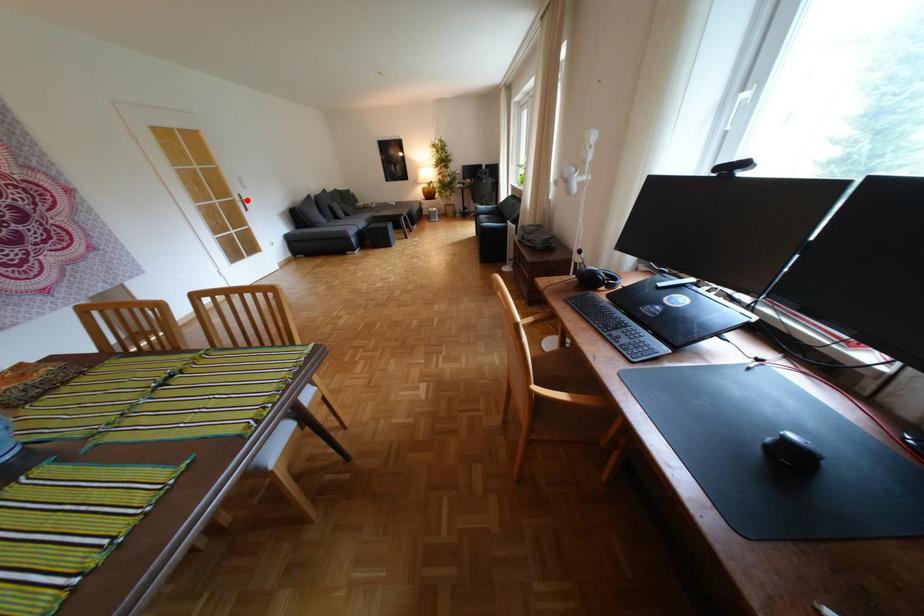
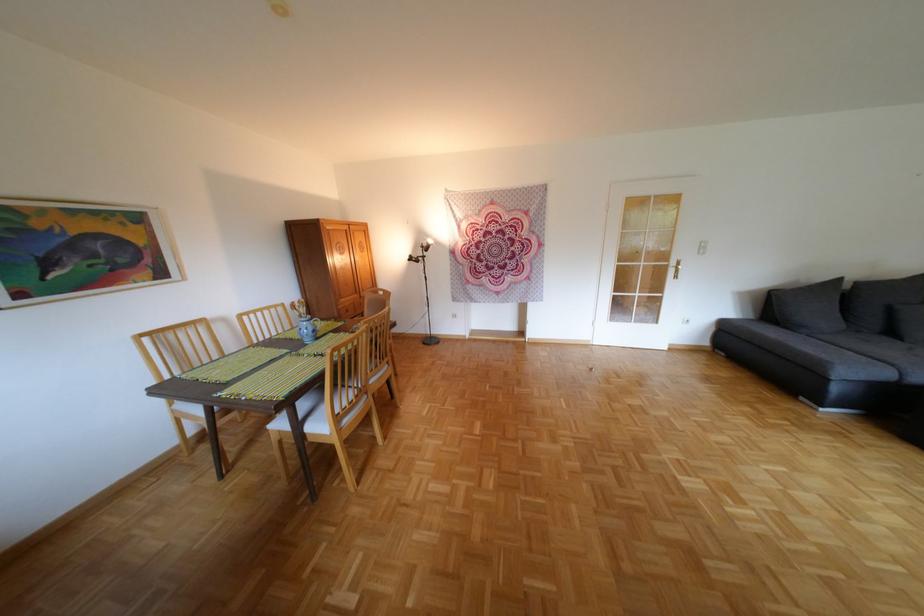
Question: I am providing you with two images of the same scene from different viewpoints. In image1, a red point is highlighted. Considering the same 3D point in image2, which of the following is correct?

Choices:
 (A) It is closer
 (B) It is farther

Answer: (B)